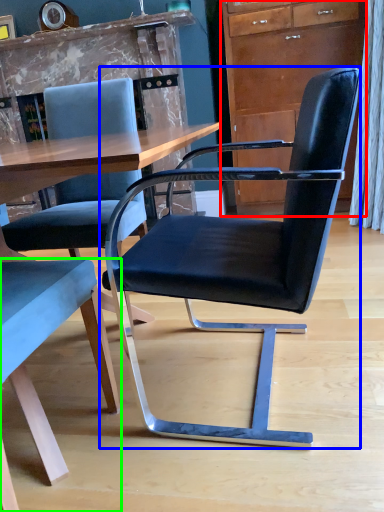
Question: Which object is the closest to the cabinetry (highlighted by a red box)? Choose among these: chair (highlighted by a blue box) or chair (highlighted by a green box).

Choices:
 (A) chair
 (B) chair

Answer: (A)